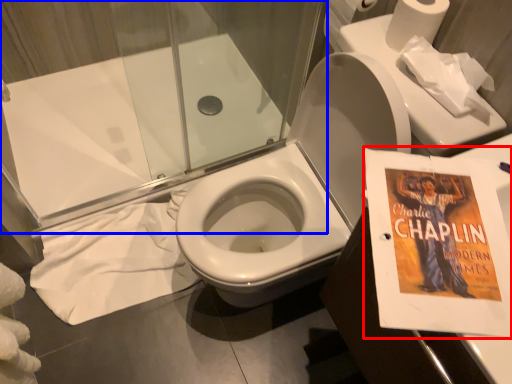
Question: Which of the following is the farthest to the observer, paperback book (highlighted by a red box) or shower door (highlighted by a blue box)?

Choices:
 (A) paperback book
 (B) shower door

Answer: (B)